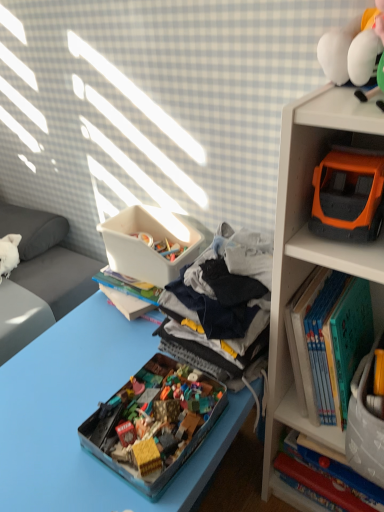
Where is `free spot behind translucent plastic toy box at center`? This screenshot has width=384, height=512. free spot behind translucent plastic toy box at center is located at coordinates (112, 353).